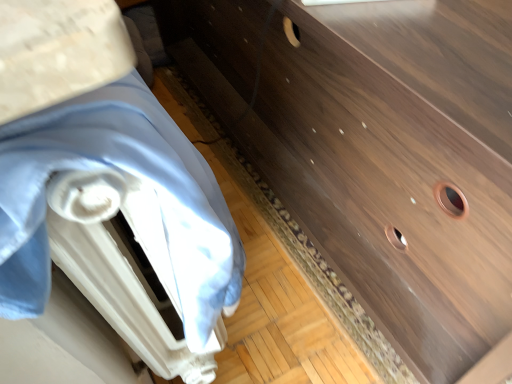
What is the approximate width of blue cotton blanket at lower left?

blue cotton blanket at lower left is 16.12 centimeters in width.

Where is `blue cotton blanket at lower left`? The width and height of the screenshot is (512, 384). blue cotton blanket at lower left is located at coordinates (131, 173).

Consider the image. Measure the distance between point (39, 220) and camera.

The depth of point (39, 220) is 28.80 centimeters.

What do you see at coordinates (131, 173) in the screenshot?
I see `blue cotton blanket at lower left` at bounding box center [131, 173].

At what (x,y) coordinates should I click in order to perform the action: click on blue cotton blanket at lower left. Please return your answer as a coordinate pair (x, y). The image size is (512, 384). Looking at the image, I should click on (131, 173).